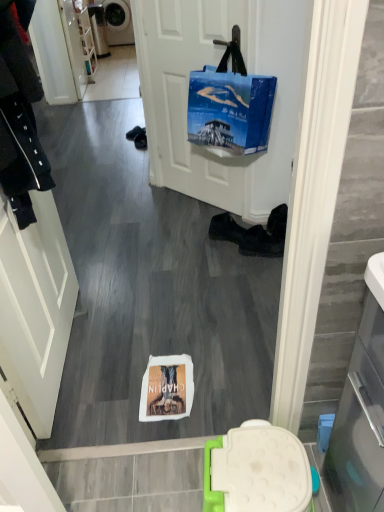
Find the location of `free point to the left of black leather boots at lower center, the second footwear positioned from the left`. free point to the left of black leather boots at lower center, the second footwear positioned from the left is located at coordinates (220, 256).